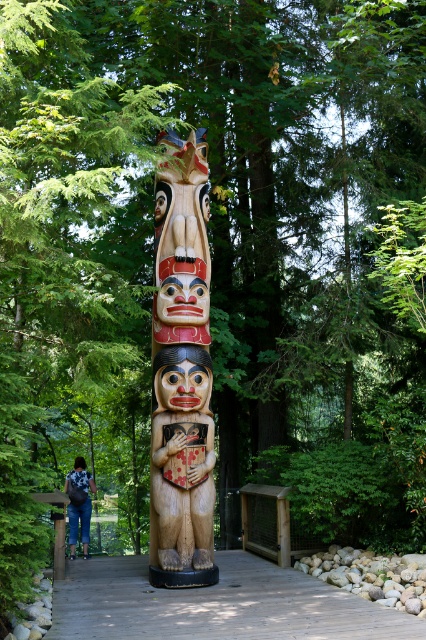
Question: Which object is farther from the camera taking this photo?

Choices:
 (A) wooden walkway at center
 (B) wooden totem pole at center

Answer: (B)

Question: Among these points, which one is nearest to the camera?

Choices:
 (A) (198, 289)
 (B) (86, 582)

Answer: (A)

Question: Estimate the real-world distances between objects in this image. Which object is farther from the carved wood totem pole at center?

Choices:
 (A) wooden totem pole at center
 (B) wooden walkway at center

Answer: (B)

Question: Is wooden totem pole at center to the right of blue jeans at lower left from the viewer's perspective?

Choices:
 (A) yes
 (B) no

Answer: (A)

Question: In this image, where is wooden walkway at center located relative to wooden totem pole at center?

Choices:
 (A) left
 (B) right

Answer: (A)

Question: Is carved wood totem pole at center thinner than wooden totem pole at center?

Choices:
 (A) no
 (B) yes

Answer: (A)